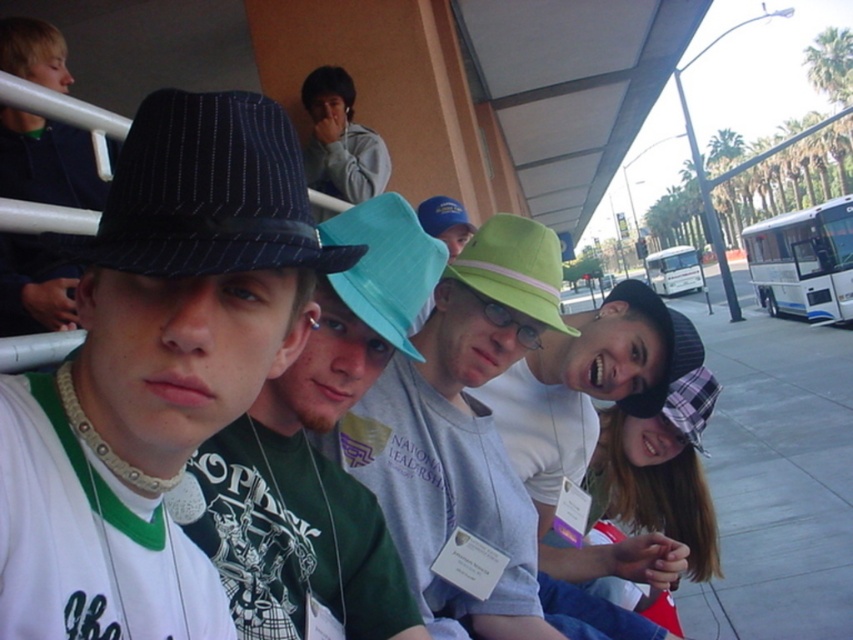
Which is in front, point (337, 186) or point (654, 326)?

Point (654, 326) is in front.

Is matte gray hoodie at upper center closer to camera compared to plaid fabric hat at center?

No, it is behind plaid fabric hat at center.

Image resolution: width=853 pixels, height=640 pixels. I want to click on matte gray hoodie at upper center, so click(x=340, y=140).

At what (x,y) coordinates should I click in order to perform the action: click on matte gray hoodie at upper center. Please return your answer as a coordinate pair (x, y). Looking at the image, I should click on (340, 140).

Does green fabric hat at center have a greater height compared to plaid fabric hat at center?

No.

Looking at this image, is green fabric hat at center above plaid fabric hat at center?

Correct, green fabric hat at center is located above plaid fabric hat at center.

What do you see at coordinates (514, 268) in the screenshot? This screenshot has width=853, height=640. I see `green fabric hat at center` at bounding box center [514, 268].

Find the location of a particular element. green fabric hat at center is located at coordinates (514, 268).

Between matte black hat at left and blue fabric cap at center, which one has less height?

blue fabric cap at center

Is point (418, 243) farther from camera compared to point (454, 211)?

No, it is not.

The image size is (853, 640). What are the coordinates of `matte black hat at left` in the screenshot? It's located at (316, 452).